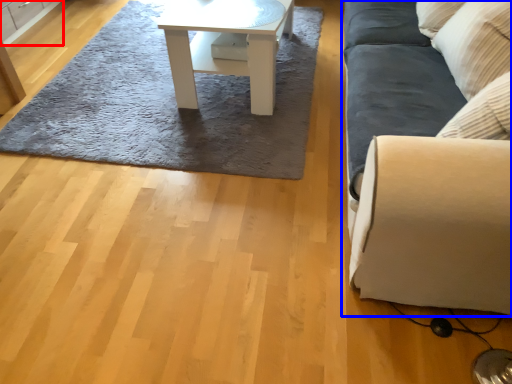
Question: Which object is further to the camera taking this photo, cabinetry (highlighted by a red box) or studio couch (highlighted by a blue box)?

Choices:
 (A) cabinetry
 (B) studio couch

Answer: (A)